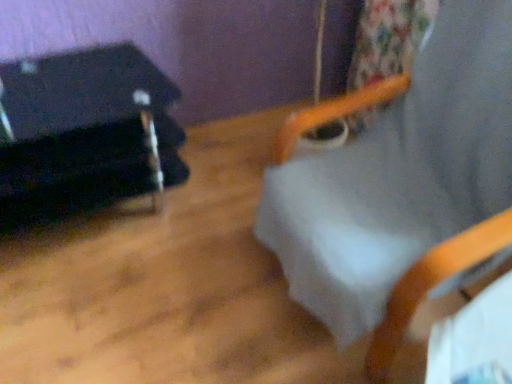
I want to click on vacant area that is in front of black fabric at left, so click(98, 306).